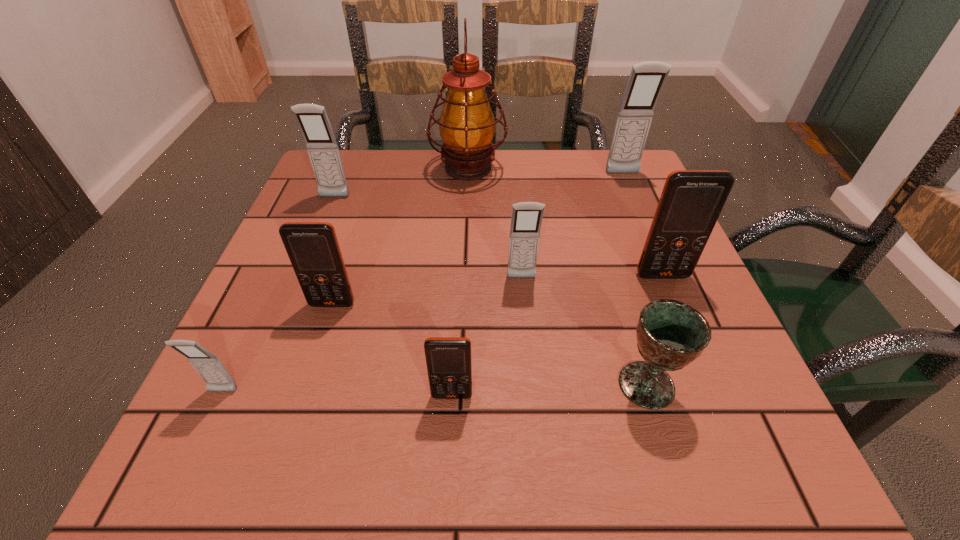
The height and width of the screenshot is (540, 960). Identify the location of blank region between the rightmost gray cellular telephone and the fifth farthest cellular telephone. (477, 239).

Locate an element on the screen. The image size is (960, 540). free space that is in between the oil lamp and the biggest orange cellular telephone is located at coordinates (565, 222).

The width and height of the screenshot is (960, 540). Identify the location of free space between the farthest orange cellular telephone and the seventh nearest object. (498, 237).

What are the coordinates of `object that is the third closest to the third cellular telephone from right to left` in the screenshot? It's located at (448, 359).

Select which object is the seventh closest to the third farthest gray cellular telephone. Please provide its 2D coordinates. Your answer should be formatted as a tuple, i.e. [(x, y)], where the tuple contains the x and y coordinates of a point satisfying the conditions above.

[(312, 119)]

Identify which cellular telephone is the nearest to the chalice. Please provide its 2D coordinates. Your answer should be formatted as a tuple, i.e. [(x, y)], where the tuple contains the x and y coordinates of a point satisfying the conditions above.

[(691, 201)]

Identify the location of cellular telephone that is the sixth closest one to the seventh nearest object. (691, 201).

Choose which gray cellular telephone is the nearest neighbor to the chalice. Please provide its 2D coordinates. Your answer should be formatted as a tuple, i.e. [(x, y)], where the tuple contains the x and y coordinates of a point satisfying the conditions above.

[(526, 219)]

Find the location of a particular element. Image resolution: width=960 pixels, height=540 pixels. gray cellular telephone object that ranks as the second closest to the eighth shortest object is located at coordinates (312, 119).

Image resolution: width=960 pixels, height=540 pixels. I want to click on the second closest orange cellular telephone to the biggest gray cellular telephone, so click(313, 249).